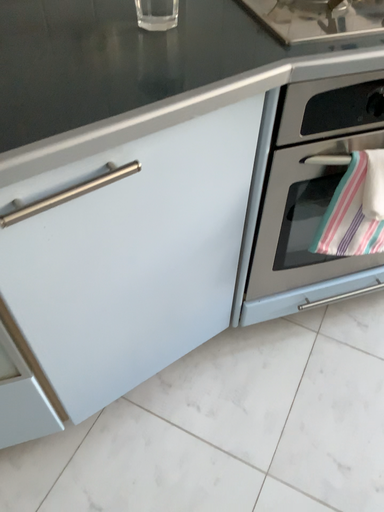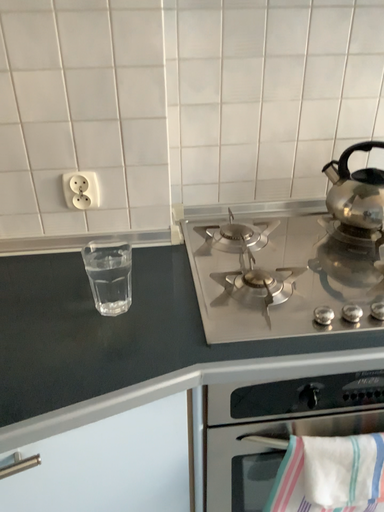
Question: How did the camera likely rotate when shooting the video?

Choices:
 (A) rotated left
 (B) rotated right

Answer: (A)